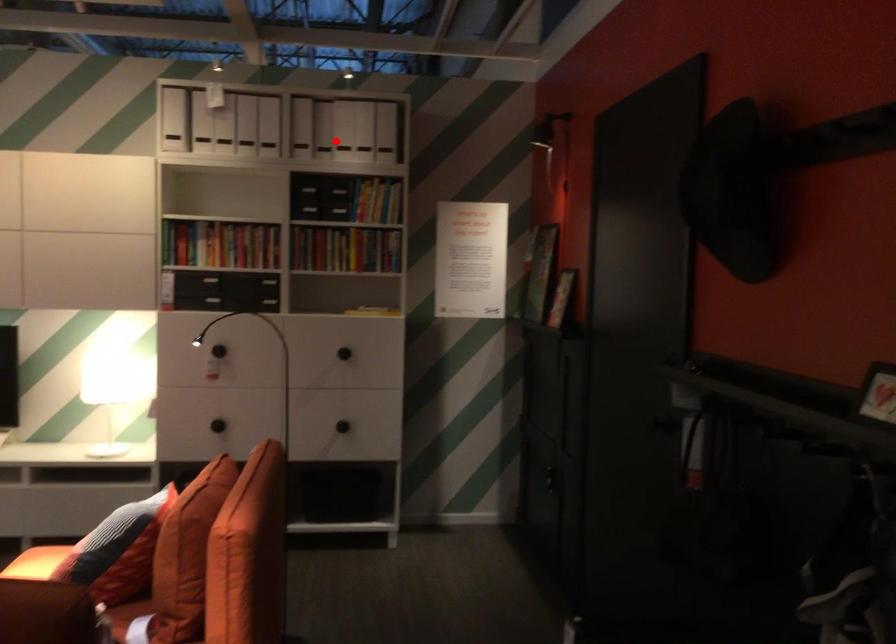
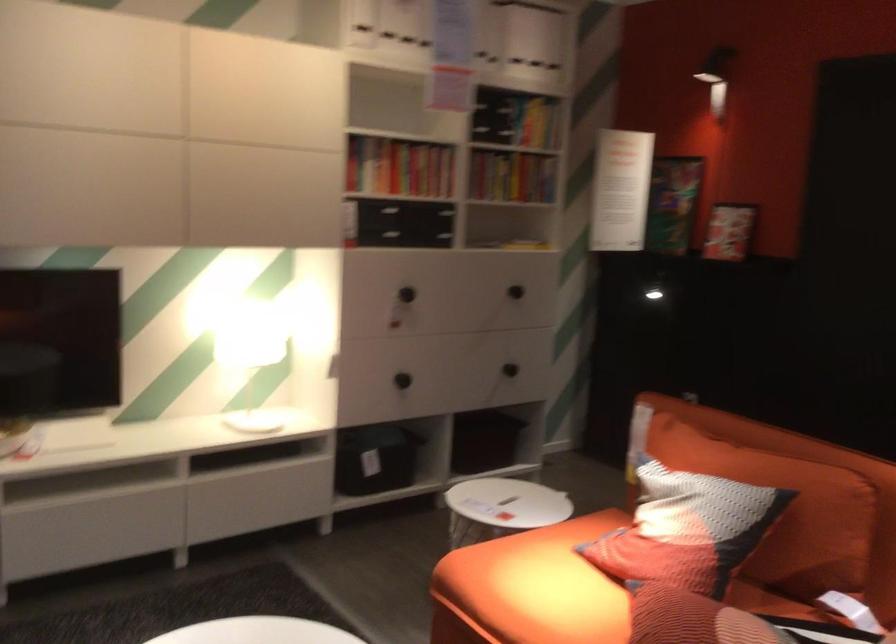
Question: I am providing you with two images of the same scene from different viewpoints. Given a red point in image1, look at the same physical point in image2. Is it:

Choices:
 (A) Closer to the viewpoint
 (B) Farther from the viewpoint

Answer: (A)